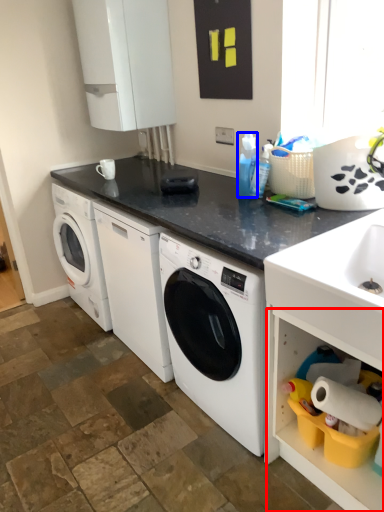
Question: Which object is closer to the camera taking this photo, shelf (highlighted by a red box) or cleaning product (highlighted by a blue box)?

Choices:
 (A) shelf
 (B) cleaning product

Answer: (A)